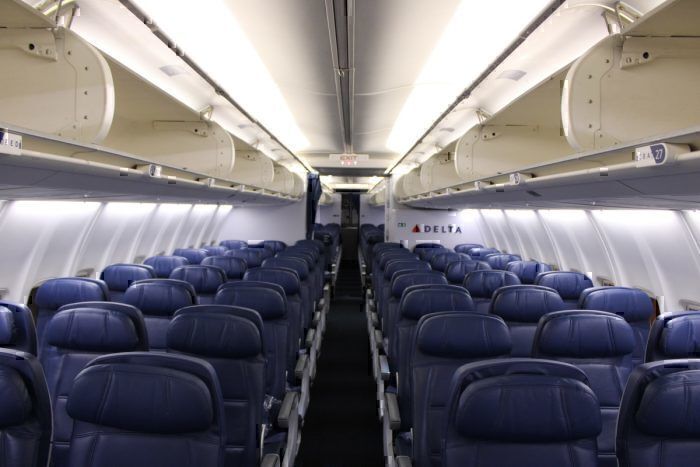
Where is `overhead bins in this cabin`? This screenshot has height=467, width=700. overhead bins in this cabin is located at coordinates (40, 99), (141, 132), (245, 163), (286, 180), (300, 187), (399, 189), (413, 184), (442, 170), (484, 154), (638, 105).